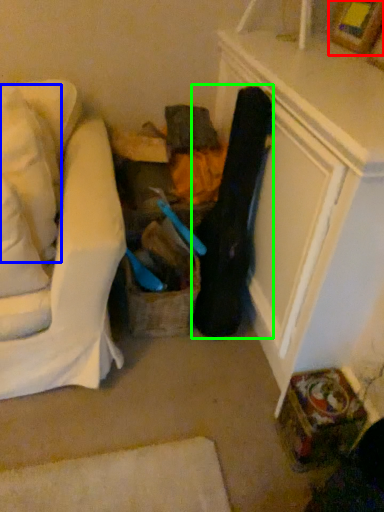
Question: Estimate the real-world distances between objects in this image. Which object is closer to picture frame (highlighted by a red box), pillow (highlighted by a blue box) or clothing (highlighted by a green box)?

Choices:
 (A) pillow
 (B) clothing

Answer: (B)